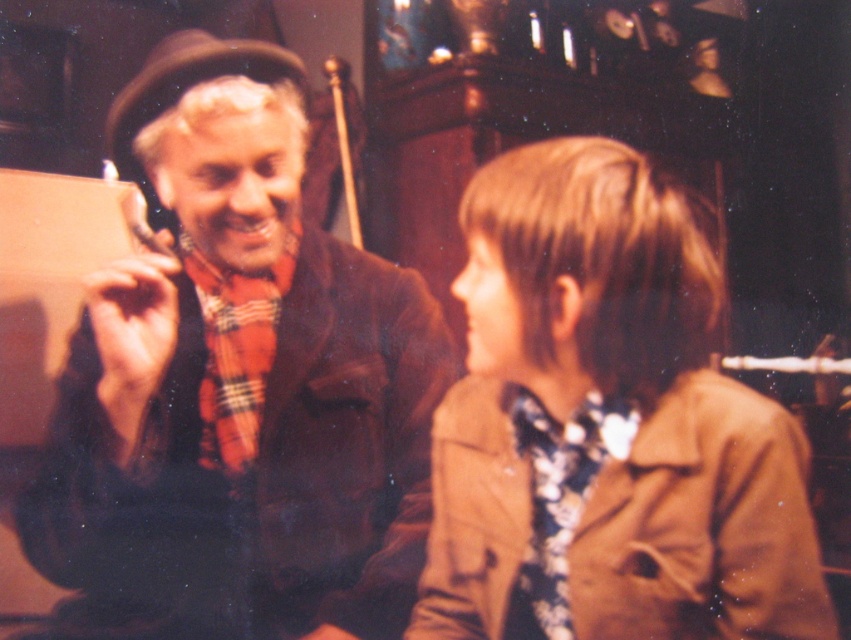
You are a tailor who needs to determine the relative height of the brown woolen sweater at left and the floral fabric tie at lower right in the image. Based on the scene, which object is taller?

The brown woolen sweater at left is much taller than the floral fabric tie at lower right.

You are standing in the room and want to move from point A to point B. Point A is at coordinate point (393,451) and point B is at coordinate point (552,596). Which point is closer to you?

Point A at coordinate point (393,451) is closer to you because it is further to the viewer than point B at coordinate point (552,596).

Based on the photo, you are a photographer trying to capture a detailed shot of both the brown leather trench coat at lower right and the floral fabric tie at lower right. Since you can only focus on one object at a time, which object should you focus on to ensure it appears clearer in the photo?

The brown leather trench coat at lower right is closer to the viewer than the floral fabric tie at lower right, so focusing on it will ensure it appears clearer in the photo.